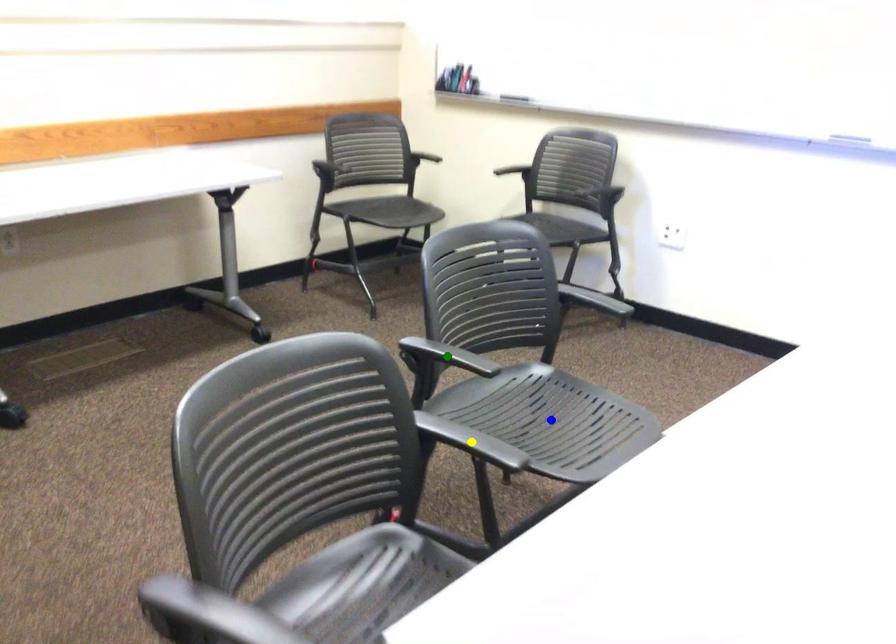
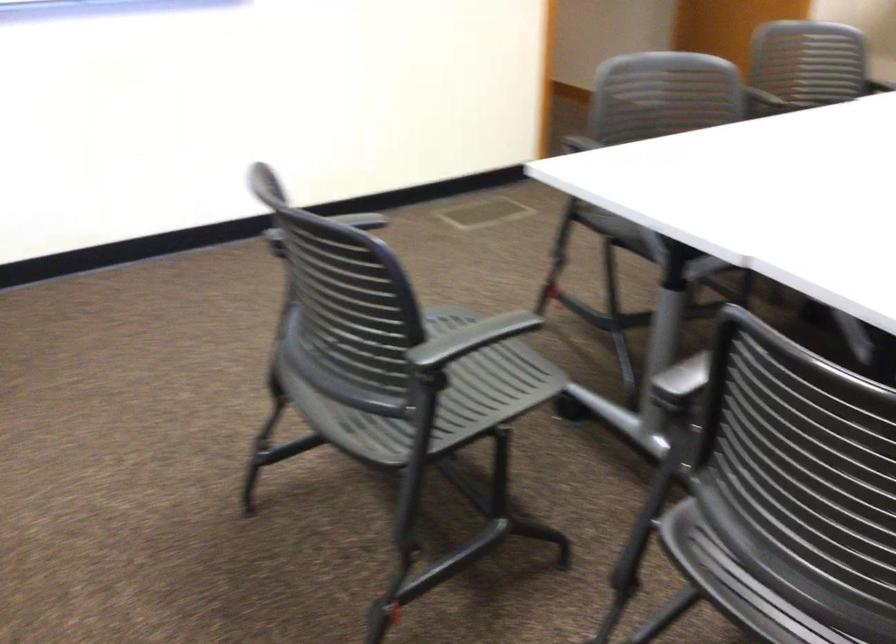
I am providing you with two images of the same scene from different viewpoints. Three points are marked in image1. Which point corresponds to a part or object that is occluded in image2?In image1, three points are marked. Which of them correspond to a part or object that is occluded in image2?Among the three points shown in image1, which one corresponds to a part or object that is no longer visible due to occlusion in image2?

green point, yellow point, blue point cannot be seen in image2.